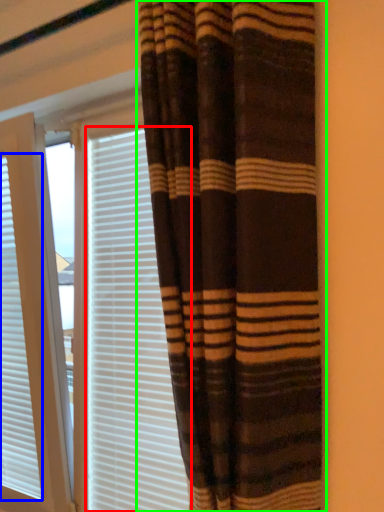
Question: Which is nearer to the blind (highlighted by a red box)? window blind (highlighted by a blue box) or curtain (highlighted by a green box).

Choices:
 (A) window blind
 (B) curtain

Answer: (A)